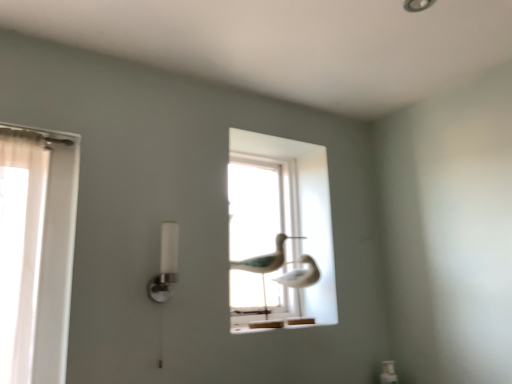
I want to click on white matte bird at center, so coord(265,263).

In order to face transparent glass birds at center, should I rotate leftwards or rightwards?

A 0.824 degree turn to the right will do.

Locate an element on the screen. transparent glass birds at center is located at coordinates (279, 225).

The height and width of the screenshot is (384, 512). In order to click on white frosted glass lamp at center left in this screenshot , I will do `click(166, 265)`.

Does point (241, 261) appear closer or farther from the camera than point (176, 274)?

Point (241, 261) is positioned farther from the camera compared to point (176, 274).

Considering the relative positions of white matte bird at center and white frosted glass lamp at center left in the image provided, is white matte bird at center to the right of white frosted glass lamp at center left from the viewer's perspective?

Yes.

Which of these two, white matte bird at center or white frosted glass lamp at center left, is bigger?

Bigger between the two is white matte bird at center.

Considering the sizes of white frosted glass lamp at center left and white matte bird at center in the image, is white frosted glass lamp at center left taller or shorter than white matte bird at center?

In the image, white frosted glass lamp at center left appears to be shorter than white matte bird at center.

Is white frosted glass lamp at center left oriented away from white matte bird at center?

No, white matte bird at center is not at the back of white frosted glass lamp at center left.

Considering the positions of point (173, 268) and point (234, 262), is point (173, 268) closer or farther from the camera than point (234, 262)?

Point (173, 268) is closer to the camera than point (234, 262).

From a real-world perspective, between transparent glass birds at center and white frosted glass lamp at center left, who is vertically higher?

transparent glass birds at center is physically above.

Can you confirm if transparent glass birds at center is taller than white frosted glass lamp at center left?

Yes.

Does transparent glass birds at center have a larger size compared to white frosted glass lamp at center left?

Indeed, transparent glass birds at center has a larger size compared to white frosted glass lamp at center left.

Between white frosted glass lamp at center left and transparent glass birds at center, which one has smaller size?

white frosted glass lamp at center left.

From a real-world perspective, relative to transparent glass birds at center, is white frosted glass lamp at center left vertically above or below?

white frosted glass lamp at center left is below transparent glass birds at center.

Is white frosted glass lamp at center left behind transparent glass birds at center?

No, the depth of white frosted glass lamp at center left is less than that of transparent glass birds at center.

Is white frosted glass lamp at center left at the right side of transparent glass birds at center?

No.

Is point (268, 172) behind point (280, 235)?

Yes, it is behind point (280, 235).

Can we say transparent glass birds at center lies outside white matte bird at center?

Absolutely, transparent glass birds at center is external to white matte bird at center.

Considering their positions, is transparent glass birds at center located in front of or behind white matte bird at center?

transparent glass birds at center is positioned farther from the viewer than white matte bird at center.

From a real-world perspective, is transparent glass birds at center below white matte bird at center?

No, from a real-world perspective, transparent glass birds at center is not under white matte bird at center.

In terms of size, does white matte bird at center appear bigger or smaller than transparent glass birds at center?

In the image, white matte bird at center appears to be smaller than transparent glass birds at center.

How different are the orientations of white matte bird at center and transparent glass birds at center in degrees?

The facing directions of white matte bird at center and transparent glass birds at center are 40.9 degrees apart.

Considering the sizes of white matte bird at center and transparent glass birds at center in the image, is white matte bird at center wider or thinner than transparent glass birds at center?

Considering their sizes, white matte bird at center looks broader than transparent glass birds at center.

At what (x,y) coordinates should I click in order to perform the action: click on lamp on the left of the white matte bird at center. Please return your answer as a coordinate pair (x, y). Looking at the image, I should click on (166, 265).

Locate an element on the screen. bird on the right of white frosted glass lamp at center left is located at coordinates (265, 263).

Which object lies nearer to the anchor point transparent glass birds at center, white matte bird at center or white frosted glass lamp at center left?

Among the two, white matte bird at center is located nearer to transparent glass birds at center.

Considering their positions, is white frosted glass lamp at center left positioned further to transparent glass birds at center than white matte bird at center?

white frosted glass lamp at center left is further to transparent glass birds at center.

From the image, which object appears to be farther from white matte bird at center, transparent glass birds at center or white frosted glass lamp at center left?

The object further to white matte bird at center is white frosted glass lamp at center left.

Considering their positions, is white frosted glass lamp at center left positioned further to white matte bird at center than transparent glass birds at center?

Based on the image, white frosted glass lamp at center left appears to be further to white matte bird at center.

Estimate the real-world distances between objects in this image. Which object is further from white frosted glass lamp at center left, white matte bird at center or transparent glass birds at center?

transparent glass birds at center is further to white frosted glass lamp at center left.

Looking at the image, which one is located further to white frosted glass lamp at center left, transparent glass birds at center or white matte bird at center?

Among the two, transparent glass birds at center is located further to white frosted glass lamp at center left.

The height and width of the screenshot is (384, 512). Find the location of `bird positioned between white frosted glass lamp at center left and transparent glass birds at center from near to far`. bird positioned between white frosted glass lamp at center left and transparent glass birds at center from near to far is located at coordinates [265, 263].